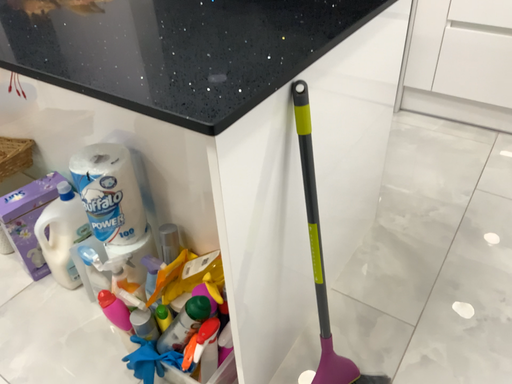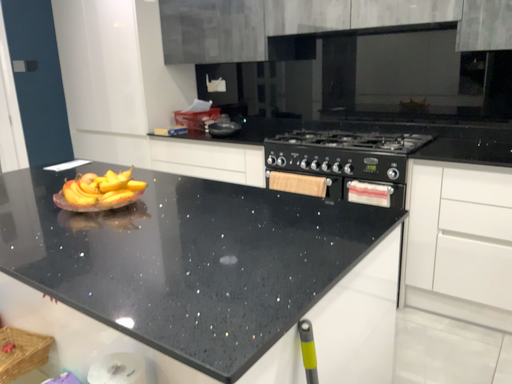
Question: How did the camera likely rotate when shooting the video?

Choices:
 (A) rotated downward
 (B) rotated upward

Answer: (B)